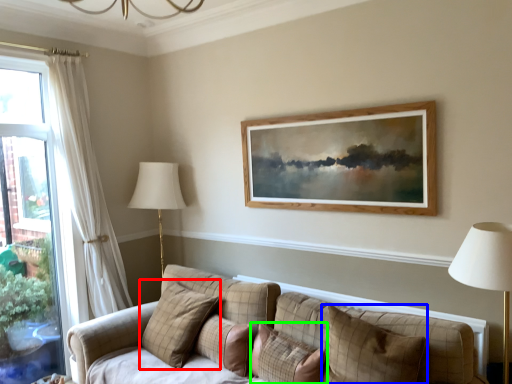
Question: Which is nearer to the pillow (highlighted by a red box)? pillow (highlighted by a blue box) or pillow (highlighted by a green box).

Choices:
 (A) pillow
 (B) pillow

Answer: (B)